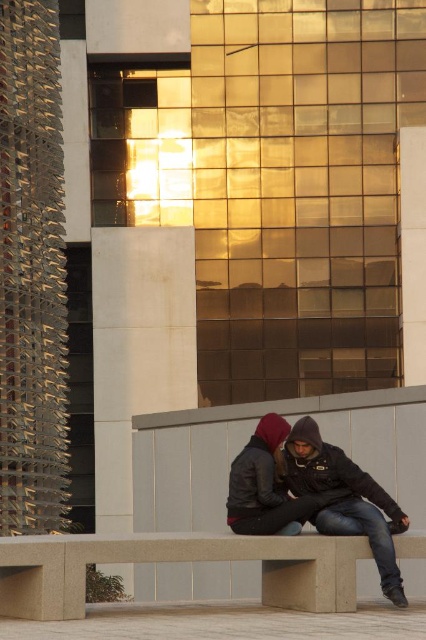
Can you confirm if smooth concrete bench at center is shorter than matte black leather jacket at center?

No.

Is smooth concrete bench at center wider than matte black leather jacket at center?

Correct, the width of smooth concrete bench at center exceeds that of matte black leather jacket at center.

In order to click on smooth concrete bench at center in this screenshot , I will do `click(176, 563)`.

Identify the location of smooth concrete bench at center. Image resolution: width=426 pixels, height=640 pixels. (176, 563).

Is dark gray hoodie at center to the left of matte black leather jacket at center from the viewer's perspective?

In fact, dark gray hoodie at center is to the right of matte black leather jacket at center.

Who is taller, dark gray hoodie at center or matte black leather jacket at center?

With more height is dark gray hoodie at center.

Measure the distance between point (327, 500) and camera.

Point (327, 500) is 19.84 meters away from camera.

Find the location of `dark gray hoodie at center`. dark gray hoodie at center is located at coordinates (316, 493).

Is point (66, 605) farther from viewer compared to point (321, 451)?

No, (66, 605) is closer to viewer.

Is smooth concrete bench at center behind dark gray hoodie at center?

No, smooth concrete bench at center is in front of dark gray hoodie at center.

You are a GUI agent. You are given a task and a screenshot of the screen. Output one action in this format:
    pyautogui.click(x=<x>, y=<y>)
    Task: Click on the smooth concrete bench at center
    The height and width of the screenshot is (640, 426).
    Given the screenshot: What is the action you would take?
    [176, 563]

This screenshot has height=640, width=426. What are the coordinates of `smooth concrete bench at center` in the screenshot? It's located at (176, 563).